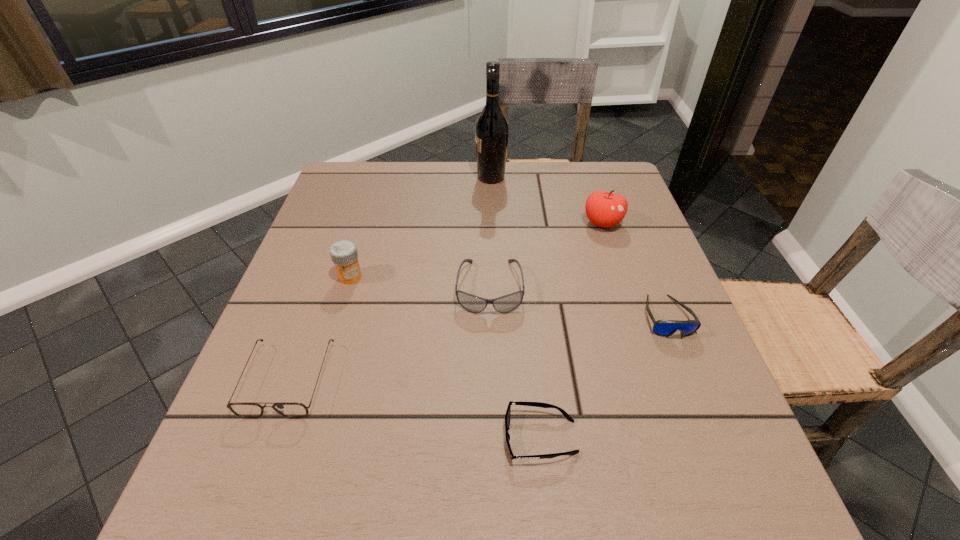
The height and width of the screenshot is (540, 960). Find the location of `vacant point that satisfies the following two spatial constraints: 1. on the front side of the second farthest object; 2. on the front-facing side of the shortest object`. vacant point that satisfies the following two spatial constraints: 1. on the front side of the second farthest object; 2. on the front-facing side of the shortest object is located at coordinates (673, 437).